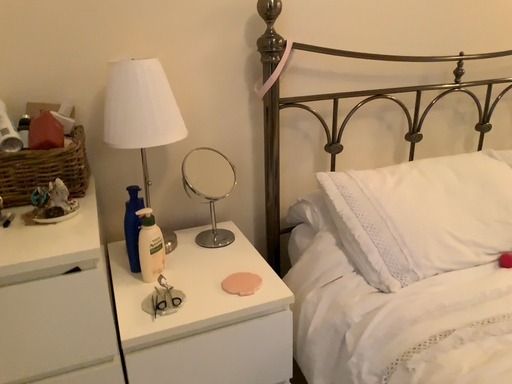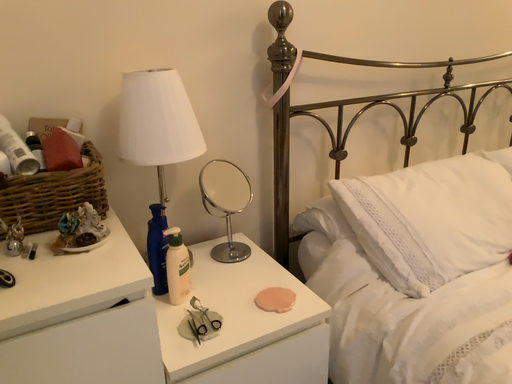
Question: Which way did the camera rotate in the video?

Choices:
 (A) rotated right
 (B) rotated left

Answer: (A)